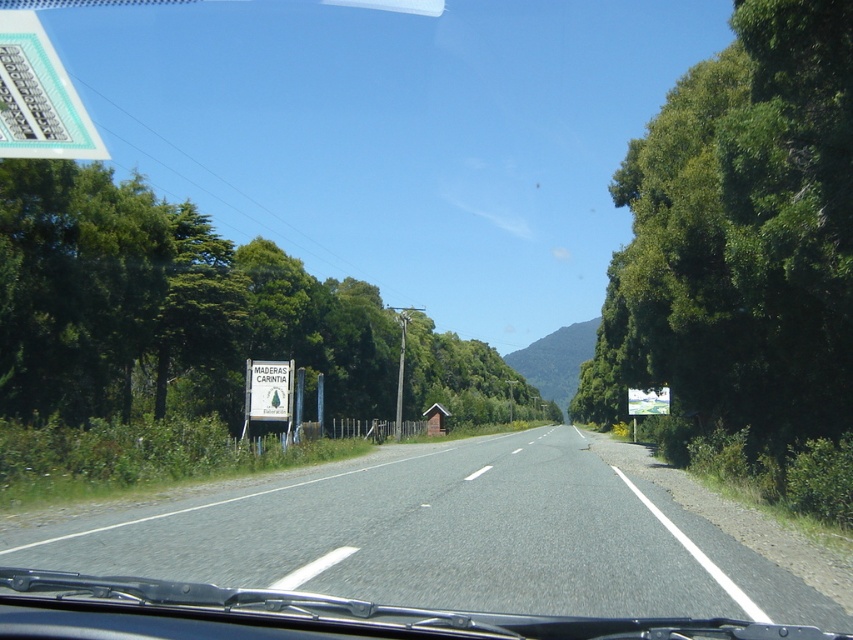
You are driving a car and looking through the windshield. You see the gray asphalt road at center and the green leafy tree at right. Which object is closer to you?

The gray asphalt road at center is closer to you because it is positioned below the green leafy tree at right, indicating it is in the foreground.

You are a driver approaching the green leafy tree at left and the green plastic sign at upper left. Which object will appear closer to you as you look through the windshield?

The green leafy tree at left will appear closer because it is bigger than the green plastic sign at upper left, and larger objects in the distance typically appear closer due to their size.

You are driving a car and notice the gray asphalt road at center and the green leafy tree at right. Which object is positioned to the left of the other?

The gray asphalt road at center is to the left of the green leafy tree at right.